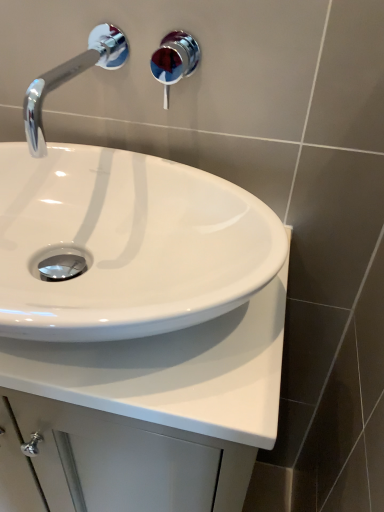
Question: From their relative heights in the image, would you say chrome/metallic faucet at upper left is taller or shorter than shiny chrome shower at upper center?

Choices:
 (A) tall
 (B) short

Answer: (B)

Question: From the image's perspective, relative to shiny chrome shower at upper center, is chrome/metallic faucet at upper left above or below?

Choices:
 (A) above
 (B) below

Answer: (B)

Question: Based on their relative distances, which object is nearer to the white glossy countertop at center?

Choices:
 (A) chrome/metallic faucet at upper left
 (B) shiny chrome shower at upper center

Answer: (A)

Question: Considering the real-world distances, which object is farthest from the chrome/metallic faucet at upper left?

Choices:
 (A) shiny chrome shower at upper center
 (B) white glossy countertop at center

Answer: (A)